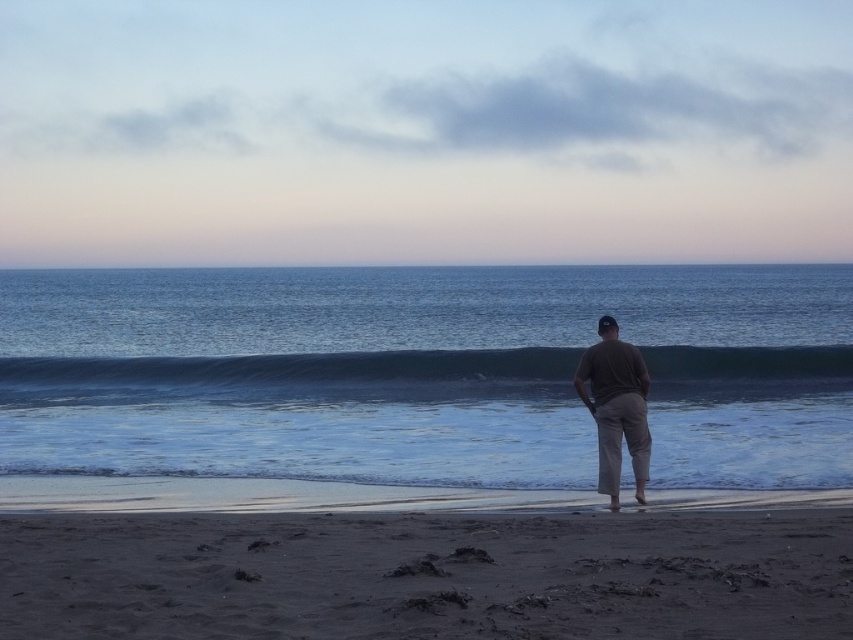
You are a GUI agent. You are given a task and a screenshot of the screen. Output one action in this format:
    pyautogui.click(x=<x>, y=<y>)
    Task: Click on the dark sand at lower center
    The image size is (853, 640).
    Given the screenshot: What is the action you would take?
    pyautogui.click(x=427, y=576)

From the picture: Between dark sand at lower center and brown cotton shirt at center, which one appears on the right side from the viewer's perspective?

From the viewer's perspective, brown cotton shirt at center appears more on the right side.

At what (x,y) coordinates should I click in order to perform the action: click on dark sand at lower center. Please return your answer as a coordinate pair (x, y). This screenshot has height=640, width=853. Looking at the image, I should click on [427, 576].

Locate an element on the screen. dark sand at lower center is located at coordinates (427, 576).

Can you confirm if blue glossy wave at center is thinner than brown cotton shirt at center?

No.

Between blue glossy wave at center and brown cotton shirt at center, which one is positioned higher?

Positioned higher is blue glossy wave at center.

Which is behind, point (837, 387) or point (634, 458)?

The point (837, 387) is more distant.

I want to click on blue glossy wave at center, so click(x=291, y=376).

Is blue water at center behind blue glossy wave at center?

Yes, it is.

Is blue water at center smaller than blue glossy wave at center?

Incorrect, blue water at center is not smaller in size than blue glossy wave at center.

Measure the distance between point (x=341, y=372) and camera.

A distance of 24.56 meters exists between point (x=341, y=372) and camera.

Where is `blue water at center`? blue water at center is located at coordinates (422, 372).